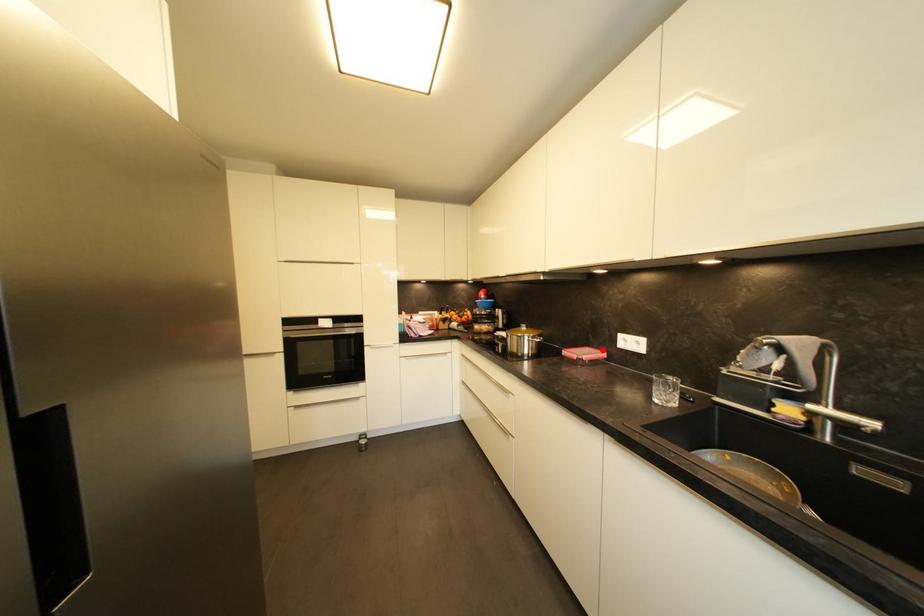
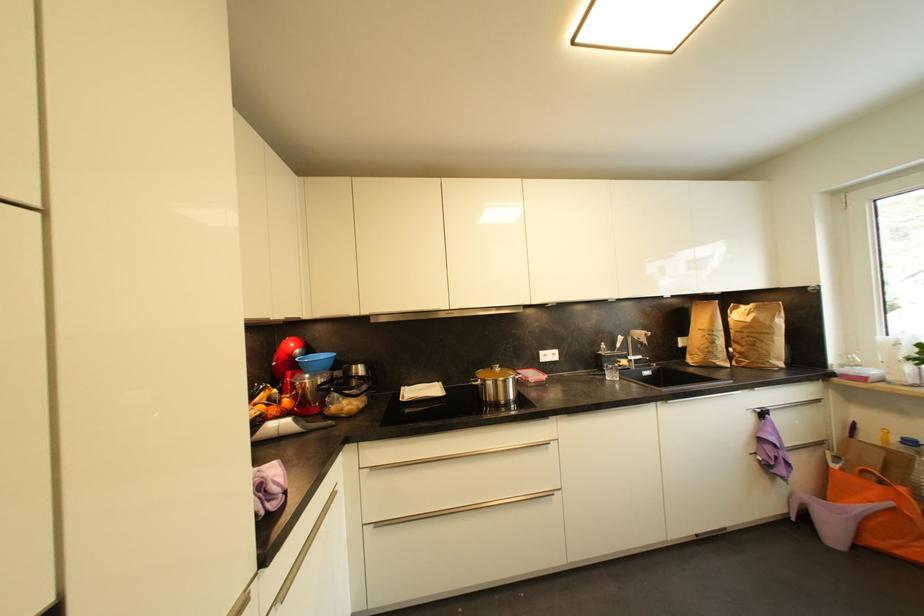
Where in the second image is the point corresponding to the highlighted location from the first image?

(528, 371)